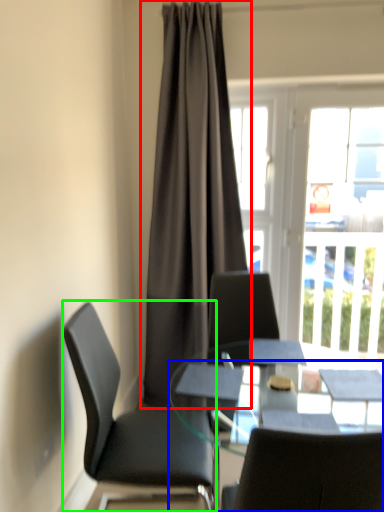
Question: Based on their relative distances, which object is farther from curtain (highlighted by a red box)? Choose from desk (highlighted by a blue box) and chair (highlighted by a green box).

Choices:
 (A) desk
 (B) chair

Answer: (A)